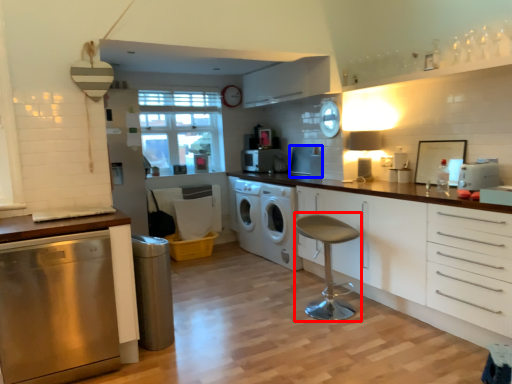
Question: Which of the following is the closest to the observer, bar stool (highlighted by a red box) or appliance (highlighted by a blue box)?

Choices:
 (A) bar stool
 (B) appliance

Answer: (A)